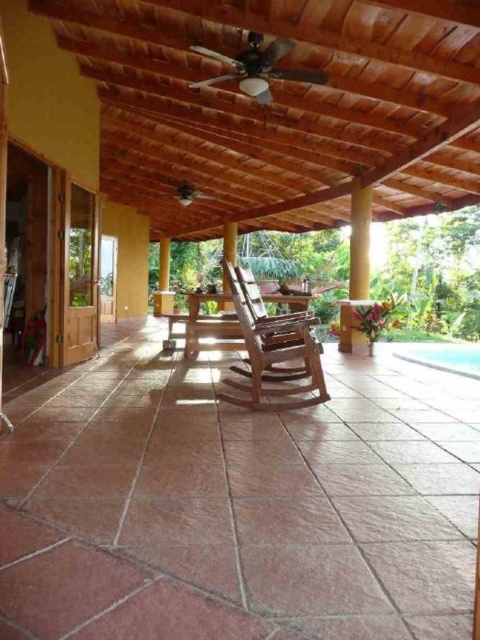
You are standing at the entrance of the patio and want to sit down. Which object at the center is located at point (272, 349)?

The wooden rocking chair at center is located at point (272, 349).

You are sitting on the wooden rocking chair at center and want to look at the clear blue water at lower right. Which direction should you turn your head to see it?

Since the wooden rocking chair at center is closer to the viewer than the clear blue water at lower right, you should turn your head downward to look at the clear blue water at lower right.